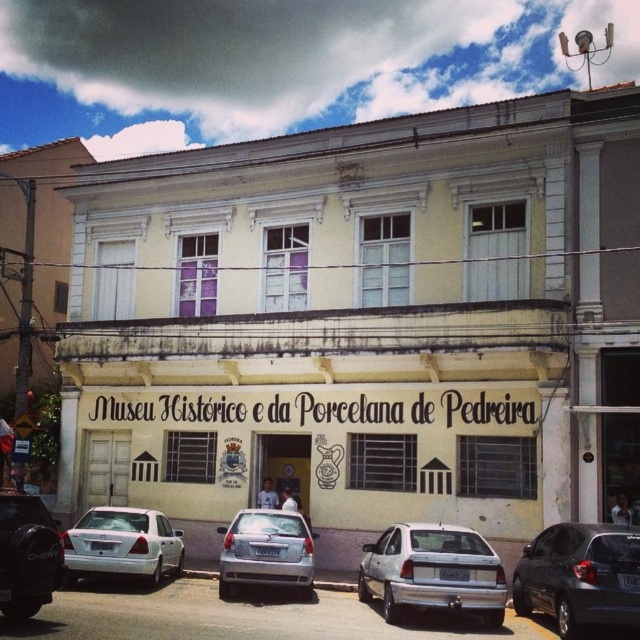
Which is behind, point (388, 538) or point (232, 579)?

The point (232, 579) is more distant.

Does white matte sedan at center have a lesser height compared to satin silver sedan at center?

Correct, white matte sedan at center is not as tall as satin silver sedan at center.

Measure the distance between point (380, 552) and camera.

The distance of point (380, 552) from camera is 104.68 feet.

The width and height of the screenshot is (640, 640). What are the coordinates of `white matte sedan at center` in the screenshot? It's located at (433, 572).

Is yellow matte building at center behind satin silver sedan at center?

Yes, yellow matte building at center is further from the viewer.

The height and width of the screenshot is (640, 640). What do you see at coordinates (364, 324) in the screenshot?
I see `yellow matte building at center` at bounding box center [364, 324].

Locate an element on the screen. yellow matte building at center is located at coordinates (364, 324).

Is white matte sedan at lower left positioned before matte black car at lower left?

No, white matte sedan at lower left is further to the viewer.

How distant is white matte sedan at lower left from matte black car at lower left?

7.49 meters

This screenshot has width=640, height=640. What are the coordinates of `white matte sedan at lower left` in the screenshot? It's located at (122, 545).